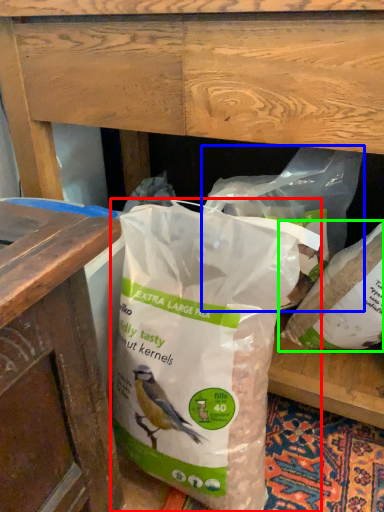
Question: Based on their relative distances, which object is nearer to plastic bag (highlighted by a red box)? Choose from plastic bag (highlighted by a blue box) and plastic bag (highlighted by a green box).

Choices:
 (A) plastic bag
 (B) plastic bag

Answer: (A)